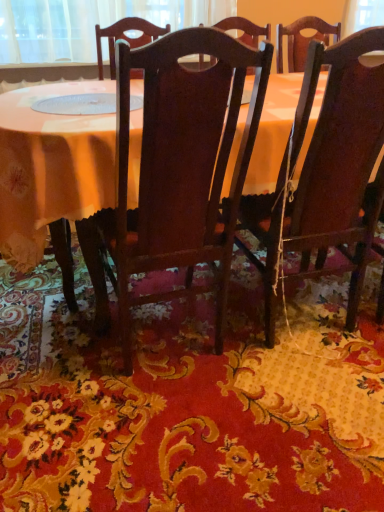
The width and height of the screenshot is (384, 512). I want to click on free space to the left of dark wood chair at center, the first chair positioned from the left, so click(60, 362).